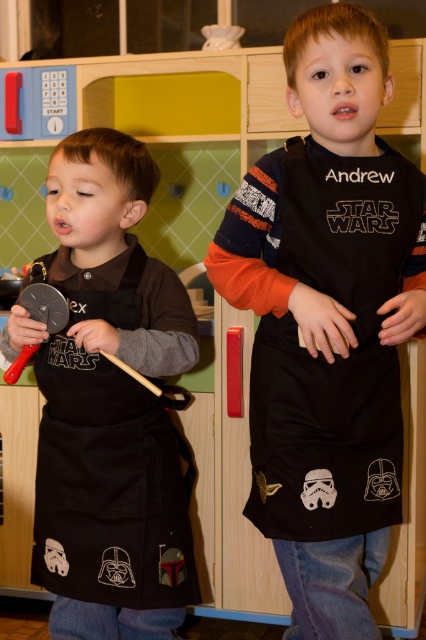
You are a photographer setting up a shoot in the play kitchen. You need to position a light source so that it illuminates the black fabric apron at center without casting a shadow on the black matte apron at left. Is this possible given their current positions?

The black fabric apron at center is in front of the black matte apron at left, so positioning a light source behind the black fabric apron at center would cast a shadow on the black matte apron at left. Therefore, it is not possible to illuminate the black fabric apron at center without casting a shadow on the black matte apron at left.

Which apron is wider, the black fabric apron at center or the black matte apron at left?

The black fabric apron at center is wider than the black matte apron at left according to the description.

Looking at this image, you are a photographer standing in front of the play kitchen scene. You need to capture a photo that includes both boys and their aprons. Based on the position of the black fabric apron at center, where should you position your camera to ensure both aprons are visible?

The black fabric apron at center is positioned at point 0.503 on the x and 0.770 on the y axis. To capture both aprons, position the camera centrally to include both aprons in the frame.